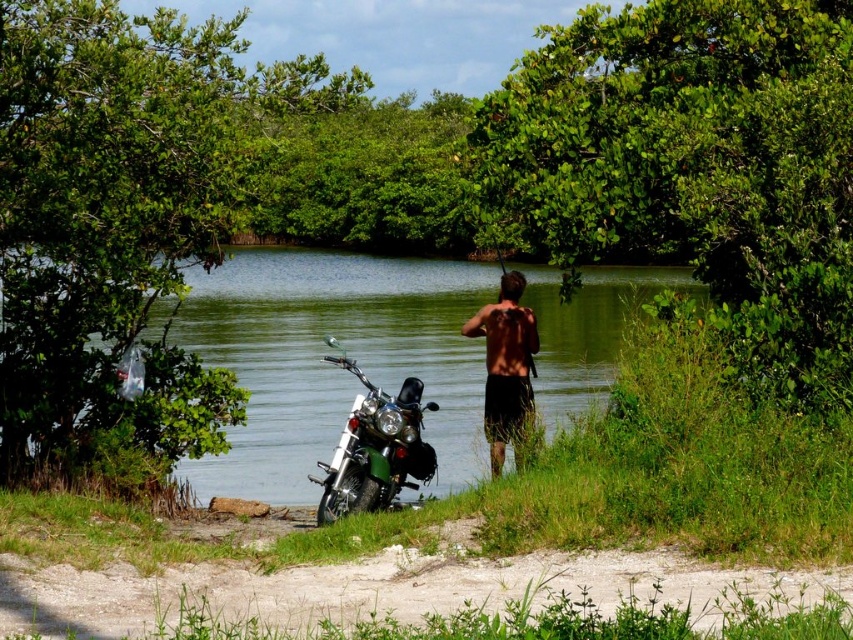
Question: Does green leafy tree at upper center appear on the left side of green metallic motorcycle at lower left?

Choices:
 (A) no
 (B) yes

Answer: (A)

Question: Which point is farther to the camera?

Choices:
 (A) (701, 45)
 (B) (312, 492)

Answer: (B)

Question: Estimate the real-world distances between objects in this image. Which object is farther from the green metallic motorcycle at lower left?

Choices:
 (A) green leafy tree at upper center
 (B) green leafy tree at left
 (C) skinnysmoothtorso at center
 (D) green water at center

Answer: (D)

Question: Which object is the closest to the green water at center?

Choices:
 (A) green leafy tree at left
 (B) shiny black shorts at center
 (C) green metallic motorcycle at lower left
 (D) skinnysmoothtorso at center

Answer: (A)

Question: Can you confirm if green leafy tree at left is thinner than green leafy tree at upper center?

Choices:
 (A) yes
 (B) no

Answer: (B)

Question: Does shiny black shorts at center appear over skinnysmoothtorso at center?

Choices:
 (A) yes
 (B) no

Answer: (B)